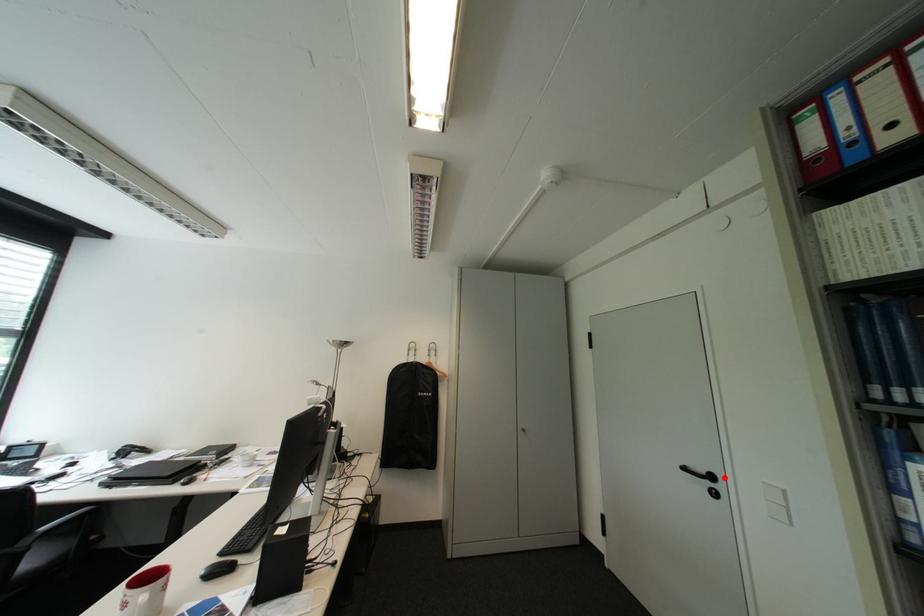
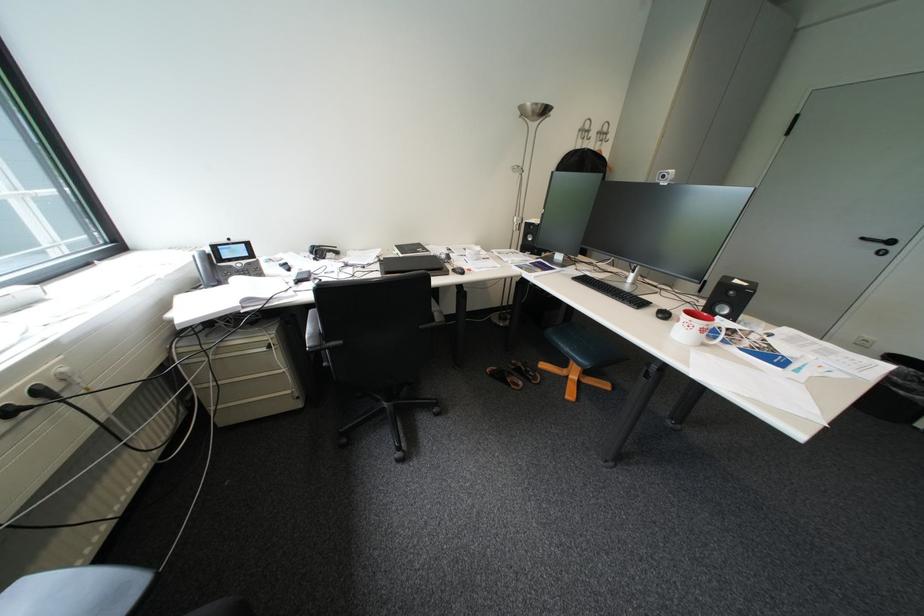
Question: I am providing you with two images of the same scene from different viewpoints. A red point is shown in image1. For the corresponding object point in image2, is it positioned nearer or farther from the camera?

Choices:
 (A) Nearer
 (B) Farther

Answer: (B)